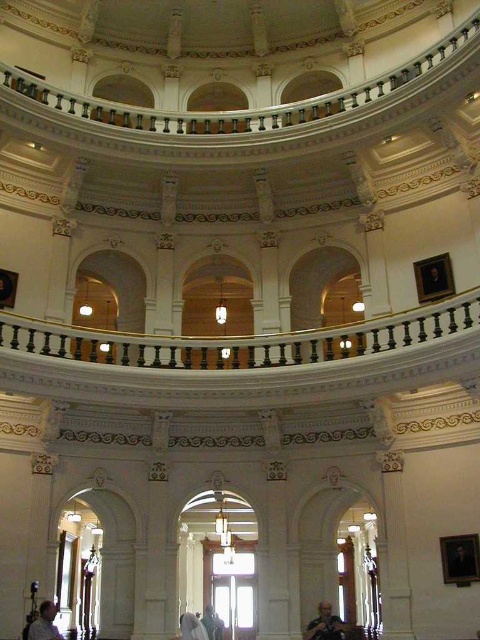
Question: Which of the following is the farthest from the observer?

Choices:
 (A) [40, 627]
 (B) [324, 634]

Answer: (B)

Question: Can you confirm if gray fabric jacket at lower center is thinner than light brown wooden chair at lower left?

Choices:
 (A) no
 (B) yes

Answer: (B)

Question: Observing the image, what is the correct spatial positioning of gray fabric jacket at lower center in reference to light brown wooden chair at lower left?

Choices:
 (A) right
 (B) left

Answer: (A)

Question: Does gray fabric jacket at lower center come behind light brown wooden chair at lower left?

Choices:
 (A) no
 (B) yes

Answer: (B)

Question: Which point appears closest to the camera in this image?

Choices:
 (A) (327, 637)
 (B) (49, 605)

Answer: (B)